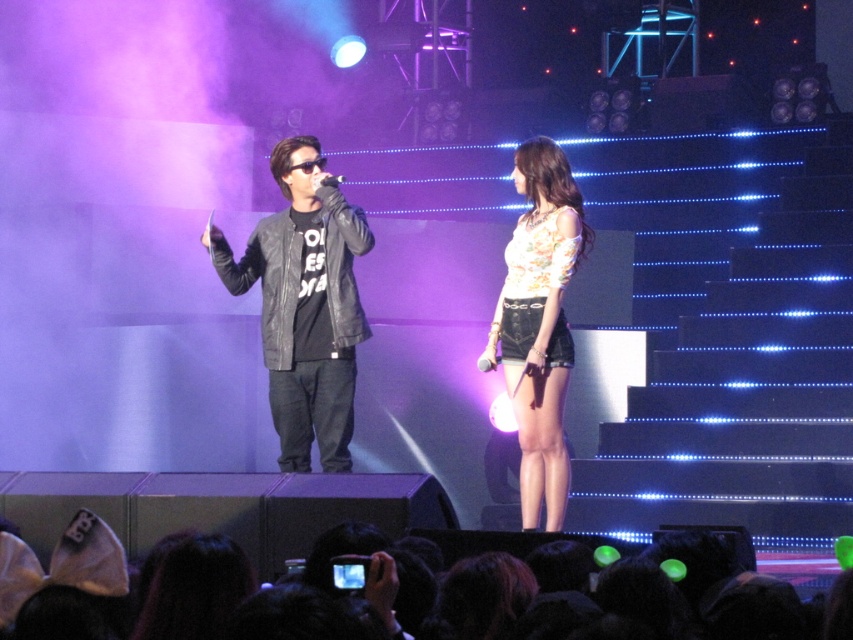
You are a photographer at the concert and want to capture both the floral fabric top at center and the black matte microphone at center in a single shot. Given their positions, which object should you ensure is in focus first to avoid blurring due to their height difference?

The floral fabric top at center is much taller than the black matte microphone at center, so you should focus on the floral fabric top at center first to ensure both are in focus.

You are a stagehand who needs to adjust the spotlight to ensure both the black leather jacket at center and the black matte microphone at center are well lit. Considering their heights, which object should you aim the spotlight at first to accommodate both?

The black leather jacket at center is much taller than the black matte microphone at center. To accommodate both, you should aim the spotlight at the black leather jacket at center first, ensuring its height is properly illuminated, then adjust to include the microphone below it.

Based on the photo, you are a photographer trying to capture the performer in the center of the stage. You notice both the black leather jacket at center and the black matte microphone at center. Which object should you focus on to ensure the performer is clearly visible?

The black leather jacket at center is in front of the black matte microphone at center, so focusing on the jacket will ensure the performer is clearly visible without obstruction.